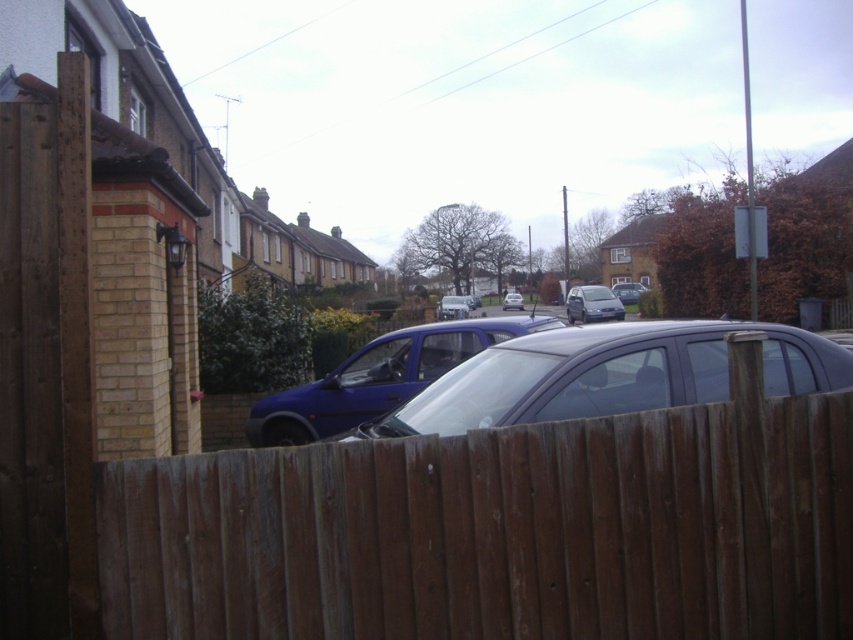
You are standing at the point with coordinates point [218,582] and want to walk towards the point with coordinates point [387,344]. Since you are in the residential street scene, will you have to go around any obstacles like the wooden fence or parked cars between these two points?

Point [218,582] is in front of point [387,344], so you can walk directly towards the point [387,344] without needing to go around obstacles like the wooden fence or parked cars between them.

You are standing on the residential street and see both the blue metallic van at center and the matte gray van at center. Which van is positioned closer to you?

The blue metallic van at center is closer to the viewer than the matte gray van at center.

You are a delivery person trying to determine if your 1.8 meter wide delivery truck can fit through the gap between the brown wooden fence at center and the matte blue car at center. Can you safely navigate through this space?

The brown wooden fence at center is wider than the matte blue car at center. However, the exact width of the gap isn